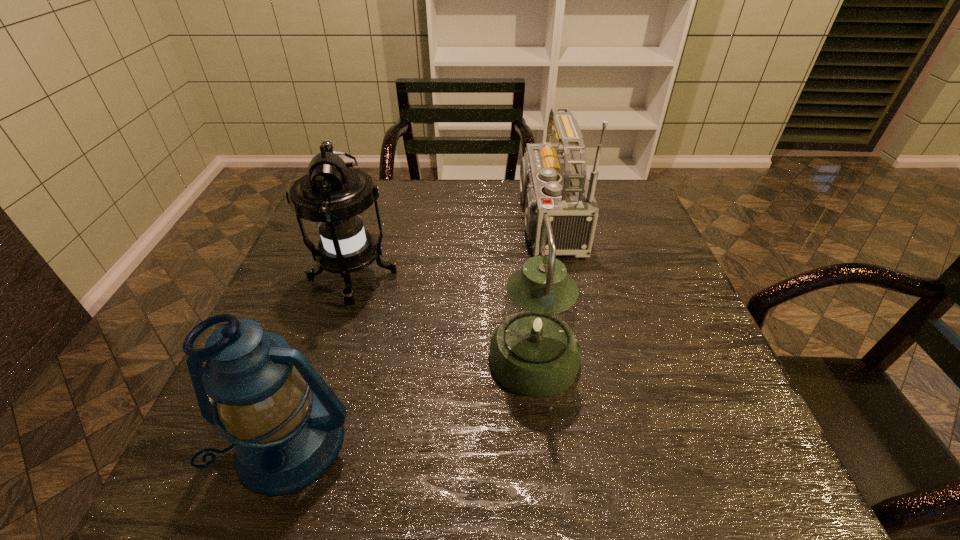
This screenshot has width=960, height=540. I want to click on lantern that stands as the second closest to the rightmost lantern, so click(256, 386).

Where is `blank area in the image that satisfies the following two spatial constraints: 1. on the front-facing side of the radio receiver; 2. on the front side of the farthest lantern`? blank area in the image that satisfies the following two spatial constraints: 1. on the front-facing side of the radio receiver; 2. on the front side of the farthest lantern is located at coordinates (550, 278).

Find the location of `blank area in the image that satisfies the following two spatial constraints: 1. on the front-facing side of the radio receiver; 2. on the front side of the rightmost lantern`. blank area in the image that satisfies the following two spatial constraints: 1. on the front-facing side of the radio receiver; 2. on the front side of the rightmost lantern is located at coordinates (564, 359).